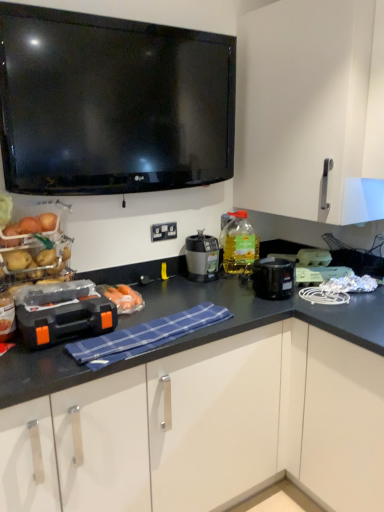
Question: From the image's perspective, is matte black blender at center below blue checkered cloth at center?

Choices:
 (A) yes
 (B) no

Answer: (B)

Question: Is matte black blender at center to the right of blue checkered cloth at center from the viewer's perspective?

Choices:
 (A) yes
 (B) no

Answer: (A)

Question: Is matte black blender at center placed right next to blue checkered cloth at center?

Choices:
 (A) no
 (B) yes

Answer: (A)

Question: From the image's perspective, is matte black blender at center located above blue checkered cloth at center?

Choices:
 (A) no
 (B) yes

Answer: (B)

Question: Is matte black blender at center positioned behind blue checkered cloth at center?

Choices:
 (A) yes
 (B) no

Answer: (A)

Question: From a real-world perspective, is clear plastic egg carton at upper right, acting as the third appliance starting from the front, physically located above or below white plastic electric outlet at center?

Choices:
 (A) above
 (B) below

Answer: (B)

Question: Do you think clear plastic egg carton at upper right, which ranks as the 2th appliance in left-to-right order, is within white plastic electric outlet at center, or outside of it?

Choices:
 (A) outside
 (B) inside

Answer: (A)

Question: Considering the positions of clear plastic egg carton at upper right, positioned as the first appliance in back-to-front order, and white plastic electric outlet at center in the image, is clear plastic egg carton at upper right, positioned as the first appliance in back-to-front order, wider or thinner than white plastic electric outlet at center?

Choices:
 (A) thin
 (B) wide

Answer: (B)

Question: In the image, is clear plastic egg carton at upper right, which ranks as the 2th appliance in left-to-right order, positioned in front of or behind white plastic electric outlet at center?

Choices:
 (A) behind
 (B) front

Answer: (B)

Question: Based on their sizes in the image, would you say white matte cabinet at upper right is bigger or smaller than blue checkered cloth at center?

Choices:
 (A) big
 (B) small

Answer: (A)

Question: Is white matte cabinet at upper right in front of or behind blue checkered cloth at center in the image?

Choices:
 (A) front
 (B) behind

Answer: (B)

Question: In terms of width, does white matte cabinet at upper right look wider or thinner when compared to blue checkered cloth at center?

Choices:
 (A) wide
 (B) thin

Answer: (A)

Question: Is point (288, 42) positioned closer to the camera than point (97, 340)?

Choices:
 (A) farther
 (B) closer

Answer: (A)

Question: In terms of size, does matte black blender at center appear bigger or smaller than orange plastic toolbox at center, which is counted as the first appliance, starting from the front?

Choices:
 (A) big
 (B) small

Answer: (B)

Question: Is point (203, 279) positioned closer to the camera than point (107, 323)?

Choices:
 (A) closer
 (B) farther

Answer: (B)